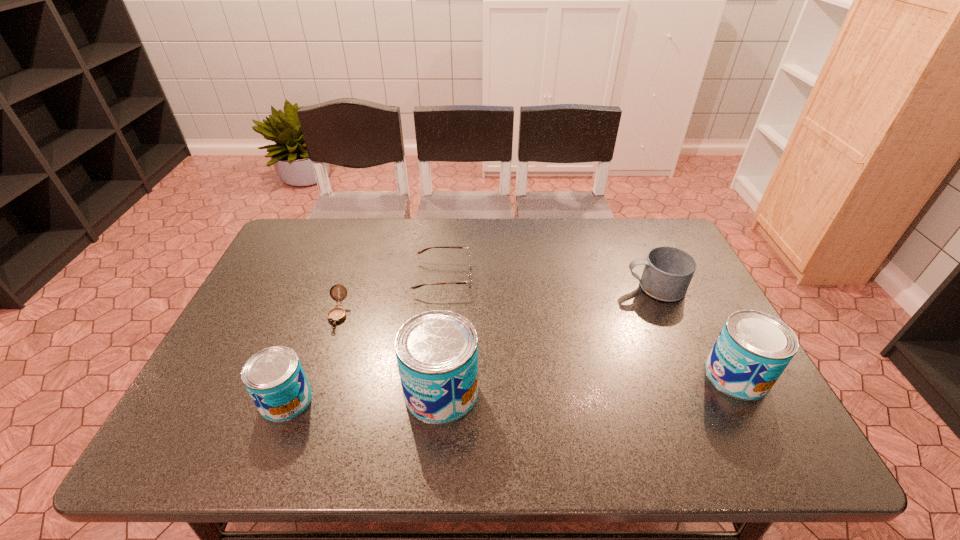
If equal spacing is the goal by inserting an additional can among them, please point out a vacant space for this new can. Please provide its 2D coordinates. Your answer should be formatted as a tuple, i.e. [(x, y)], where the tuple contains the x and y coordinates of a point satisfying the conditions above.

[(591, 383)]